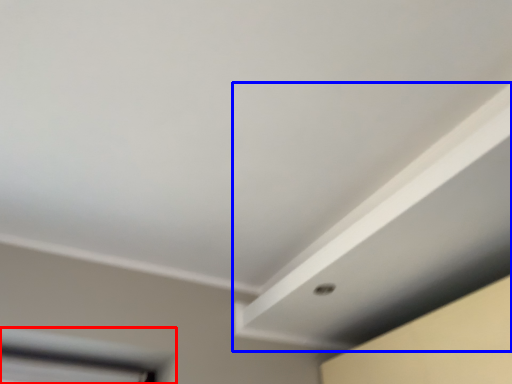
Question: Which object is further to the camera taking this photo, window (highlighted by a red box) or exhaust hood (highlighted by a blue box)?

Choices:
 (A) window
 (B) exhaust hood

Answer: (A)